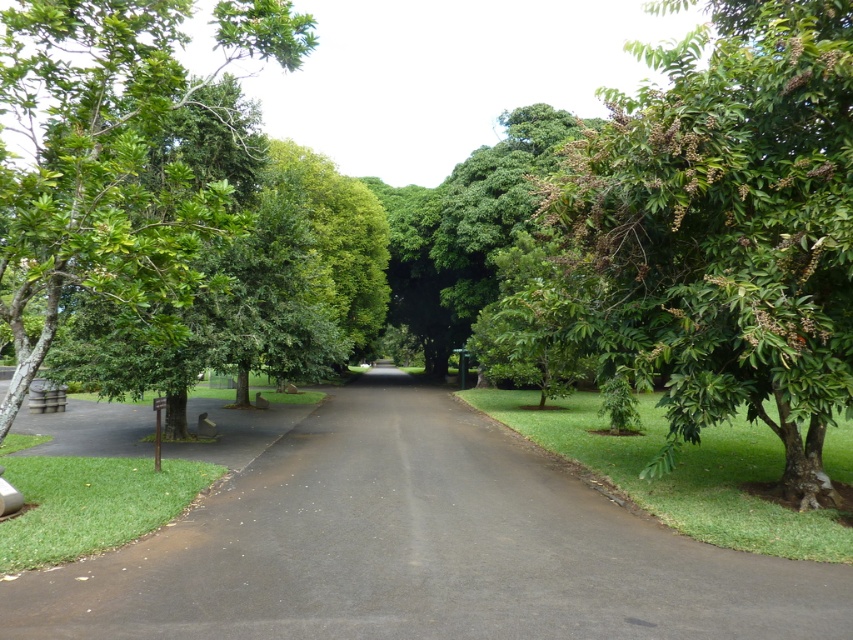
Question: Which of the following is the farthest from the observer?

Choices:
 (A) green leafy tree at right
 (B) black asphalt road at center

Answer: (A)

Question: Is black asphalt road at center wider than green leafy tree at right?

Choices:
 (A) no
 (B) yes

Answer: (B)

Question: Is black asphalt road at center to the right of green leafy tree at right from the viewer's perspective?

Choices:
 (A) yes
 (B) no

Answer: (B)

Question: Can you confirm if black asphalt road at center is positioned below green leafy tree at right?

Choices:
 (A) no
 (B) yes

Answer: (B)

Question: Which point is closer to the camera taking this photo?

Choices:
 (A) (544, 476)
 (B) (582, 204)

Answer: (B)